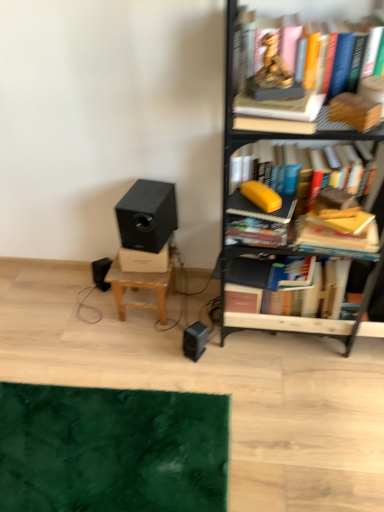
This screenshot has width=384, height=512. I want to click on free space in front of metallic black bookcase at right, so click(x=294, y=402).